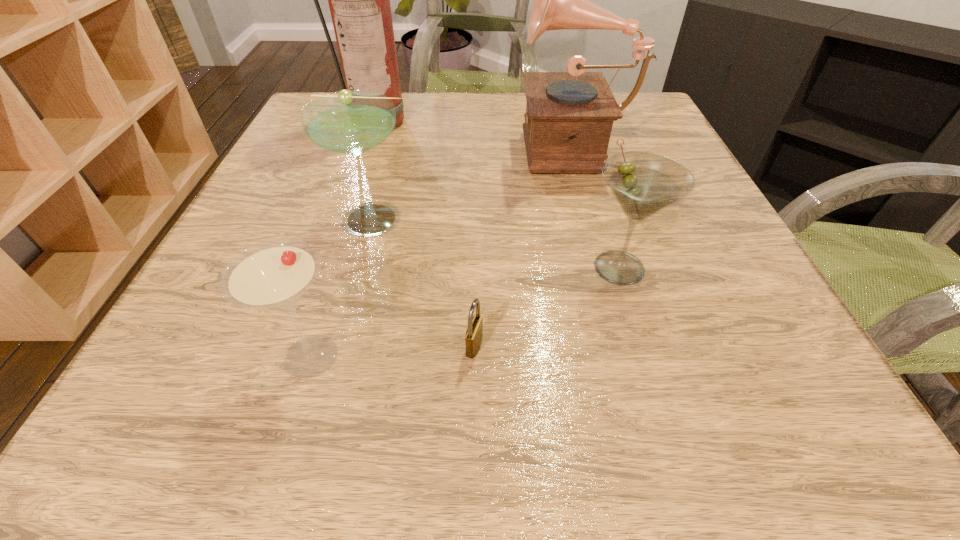
This screenshot has width=960, height=540. What are the coordinates of `fire extinguisher` in the screenshot? It's located at (359, 0).

This screenshot has height=540, width=960. Find the location of `record player`. record player is located at coordinates (569, 116).

Where is `the rightmost martini`? The image size is (960, 540). the rightmost martini is located at coordinates (643, 183).

Identify the location of the nearest martini. (274, 275).

The image size is (960, 540). Find the location of `the shortest martini`. the shortest martini is located at coordinates [274, 275].

Image resolution: width=960 pixels, height=540 pixels. Find the location of `the fourth object from left to right`. the fourth object from left to right is located at coordinates (474, 334).

What are the coordinates of `the shortest object` in the screenshot? It's located at (474, 334).

Image resolution: width=960 pixels, height=540 pixels. Identify the location of free space located 0.330m on the side of the fire extinguisher with the label and nozzle. pos(344,229).

Identify the location of free location located on the horn of the record player. (418, 144).

What are the coordinates of `free region located 0.300m on the horn of the record player` in the screenshot? It's located at (381, 144).